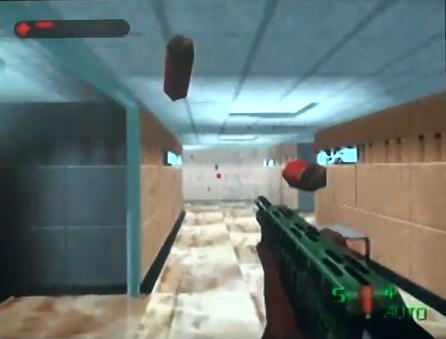
Image resolution: width=446 pixels, height=339 pixels. Identify the location of light. (277, 110).